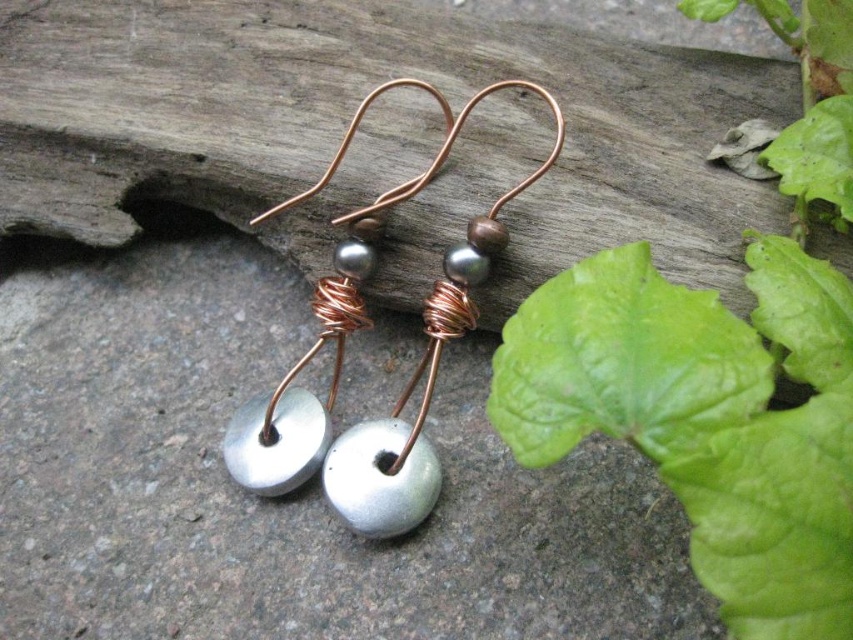
You are a jewelry designer trying to create a pair of earrings that balance proportions. You have two beads to choose from for the center of each earring. The matte silver bead at center and the metallic silver bead at center. Which bead should you use if you want the central part of the earring to be wider?

The matte silver bead at center has a larger width than the metallic silver bead at center, so you should use the matte silver bead at center if you want the central part of the earring to be wider.

Based on the photo, you are an artisan examining the earrings. You need to place a new bead between the matte silver bead at center and the metallic silver bead at center. Which bead should you place the new bead closer to?

The new bead should be placed closer to the metallic silver bead at center because the matte silver bead at center is already positioned to the left of it.

You are an artisan examining the handmade earrings on the weathered wooden surface. You notice two beads at the center of each earring component. Which bead is bigger between the matte silver bead at center and the metallic silver bead at center?

The matte silver bead at center is larger in size compared to the metallic silver bead at center.